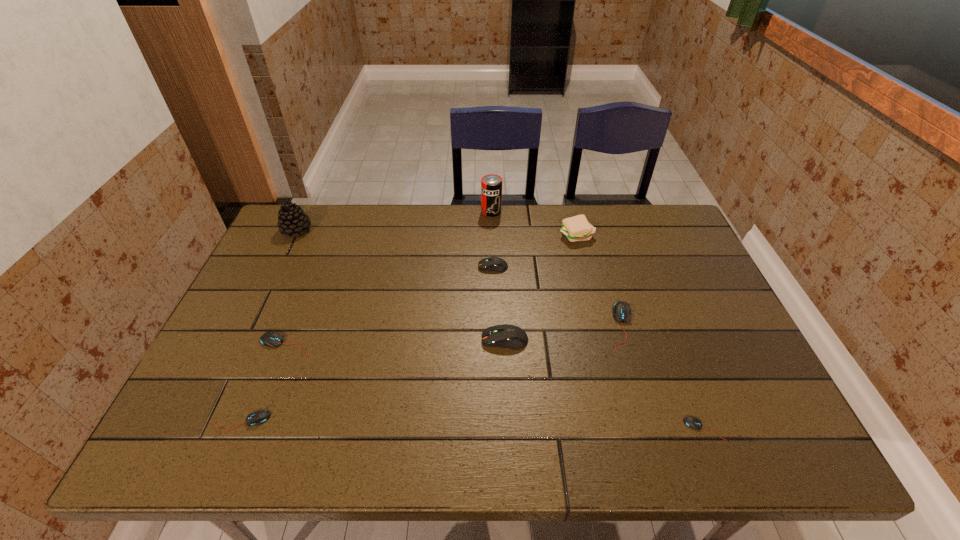
The width and height of the screenshot is (960, 540). I want to click on vacant region that satisfies the following two spatial constraints: 1. on the button of the farther dark computer equipment; 2. on the right side of the rightmost mouse, so click(498, 429).

At what (x,y) coordinates should I click in order to perform the action: click on vacant space that satisfies the following two spatial constraints: 1. at the narrow end of the second shortest mouse; 2. on the right side of the pinecone. Please return your answer as a coordinate pair (x, y). Looking at the image, I should click on (204, 421).

Where is `free space that satisfies the following two spatial constraints: 1. on the button of the bigger dark computer equipment; 2. on the front side of the second shortest mouse`? free space that satisfies the following two spatial constraints: 1. on the button of the bigger dark computer equipment; 2. on the front side of the second shortest mouse is located at coordinates (509, 421).

I want to click on vacant point that satisfies the following two spatial constraints: 1. at the narrow end of the pinecone; 2. on the back side of the patty, so pos(294,236).

In order to click on blank area in the image that satisfies the following two spatial constraints: 1. on the button of the rightmost black mouse; 2. on the right side of the fifth shortest object in this screenshot , I will do `click(498, 429)`.